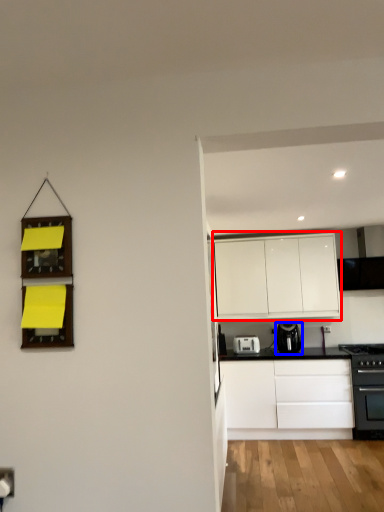
Question: Which object is further to the camera taking this photo, cabinetry (highlighted by a red box) or kitchen appliance (highlighted by a blue box)?

Choices:
 (A) cabinetry
 (B) kitchen appliance

Answer: (A)